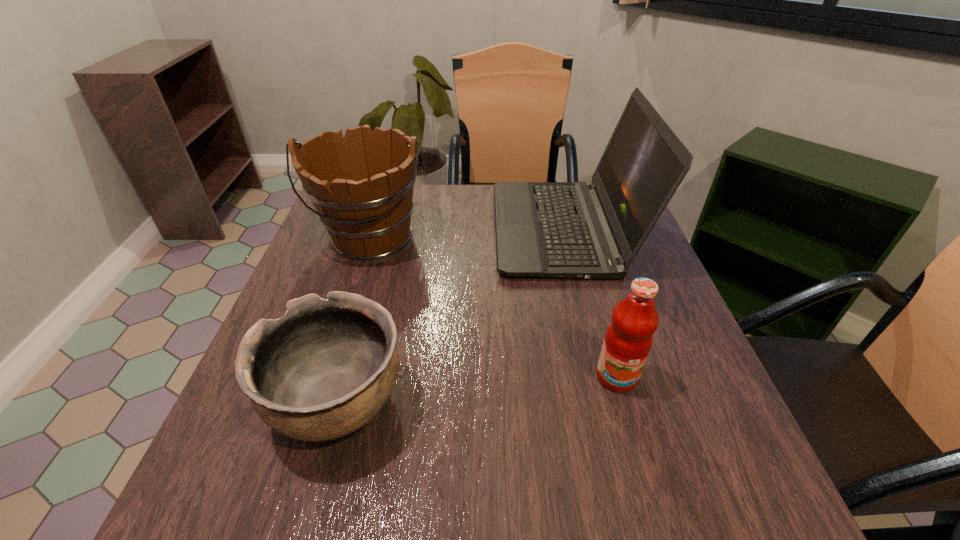
You are a GUI agent. You are given a task and a screenshot of the screen. Output one action in this format:
    pyautogui.click(x=<x>, y=<y>)
    Task: Click on the laptop_computer
    This screenshot has height=540, width=960.
    Given the screenshot: What is the action you would take?
    pyautogui.click(x=593, y=230)

At what (x,y) coordinates should I click in order to perform the action: click on wine bucket. Please return your answer as a coordinate pair (x, y). The image size is (960, 540). Looking at the image, I should click on (361, 185).

Where is `fruit juice`? fruit juice is located at coordinates (628, 339).

The width and height of the screenshot is (960, 540). Find the location of `pottery`. pottery is located at coordinates (325, 369).

At what (x,y) coordinates should I click in order to perform the action: click on free space located on the screen of the laptop_computer. Please return your answer as a coordinate pair (x, y). Looking at the image, I should click on (339, 230).

The image size is (960, 540). Find the location of `vacant region located 0.140m on the screen of the laptop_computer`. vacant region located 0.140m on the screen of the laptop_computer is located at coordinates (441, 230).

Image resolution: width=960 pixels, height=540 pixels. Identify the location of vacant area located 0.320m on the screen of the laptop_computer. (370, 230).

You are a GUI agent. You are given a task and a screenshot of the screen. Output one action in this format:
    pyautogui.click(x=<x>, y=<y>)
    Task: Click on the vacant space located 0.090m with the handle on the wine bucket
    This screenshot has height=540, width=960.
    Given the screenshot: What is the action you would take?
    click(351, 299)

Identify the location of free space located on the front label of the second shortest object. (629, 420).

This screenshot has width=960, height=540. Identify the location of free space located 0.380m on the back of the pottery. point(385,233).